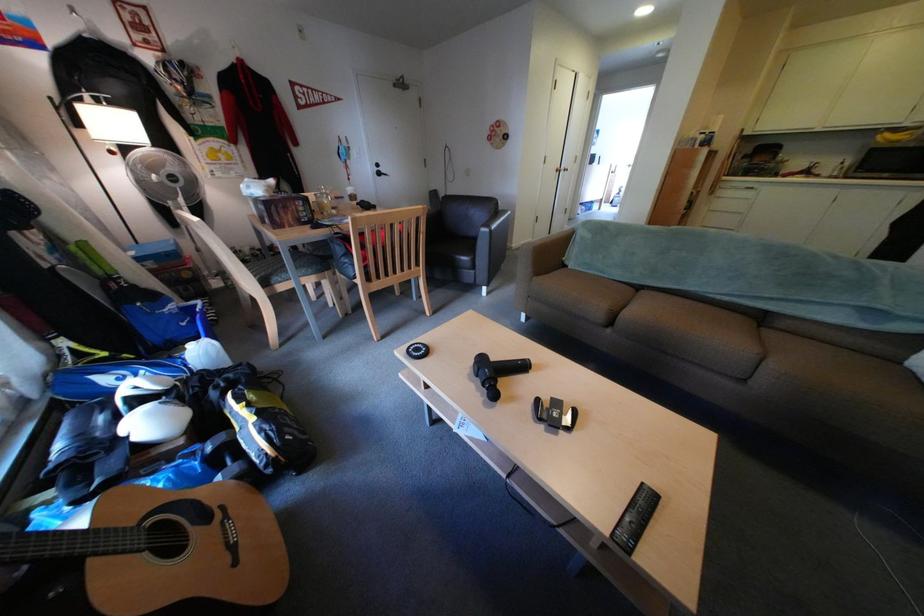
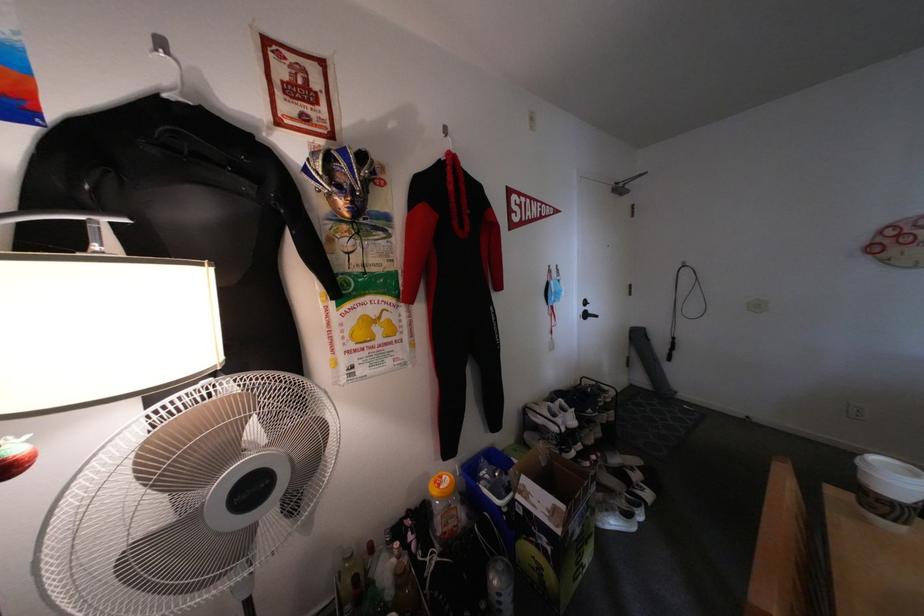
The images are taken continuously from a first-person perspective. In which direction are you moving?

The cameraman walked toward left, forward.